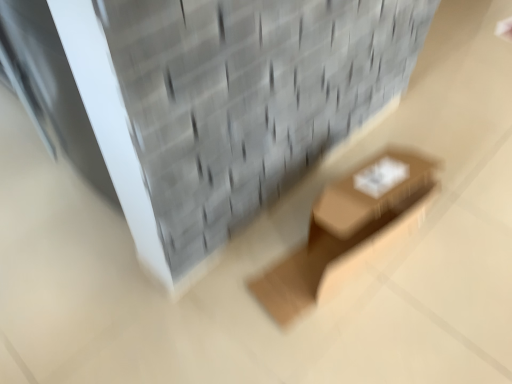
This screenshot has height=384, width=512. In order to click on vacant space to the right of brown cardboard box at center in this screenshot , I will do `click(455, 249)`.